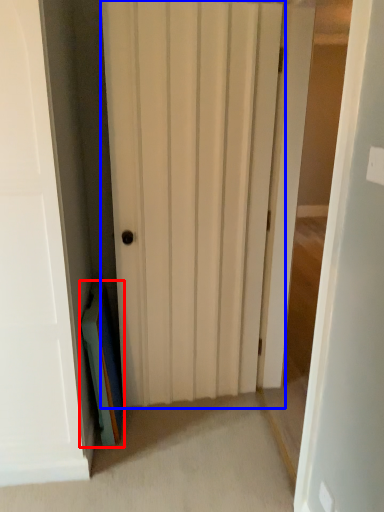
Question: Among these objects, which one is nearest to the camera, book (highlighted by a red box) or door (highlighted by a blue box)?

Choices:
 (A) book
 (B) door

Answer: (B)